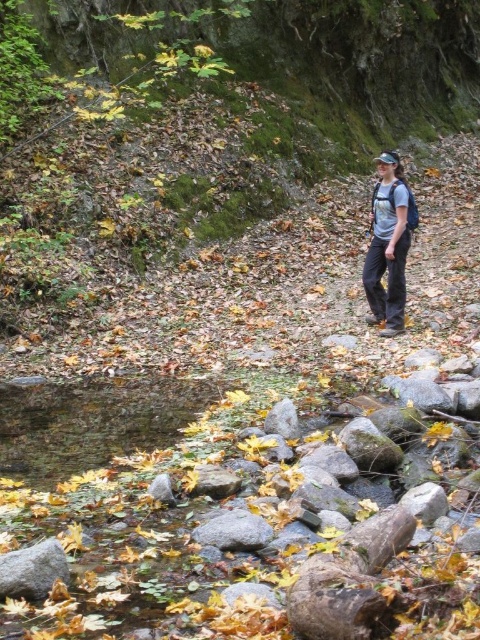
Is green mossy hillside at center shorter than gray rock at lower left?

No.

Is green mossy hillside at center bigger than gray rock at lower left?

Yes.

Where is `green mossy hillside at center`? This screenshot has width=480, height=640. green mossy hillside at center is located at coordinates (219, 177).

You are a GUI agent. You are given a task and a screenshot of the screen. Output one action in this format:
    pyautogui.click(x=<x>, y=<y>)
    Task: Click on the green mossy hillside at center
    The height and width of the screenshot is (640, 480).
    Given the screenshot: What is the action you would take?
    pyautogui.click(x=219, y=177)

At what (x,y) coordinates should I click in order to perform the action: click on green mossy hillside at center. Please return your answer as a coordinate pair (x, y). The image size is (480, 640). Looking at the image, I should click on (219, 177).

Can you confirm if green mossy hillside at center is taller than matte gray shirt at center?

Yes.

Image resolution: width=480 pixels, height=640 pixels. In order to click on green mossy hillside at center in this screenshot , I will do `click(219, 177)`.

Identify the location of green mossy hillside at center. The width and height of the screenshot is (480, 640). (219, 177).

Looking at this image, which of these two, matte gray shirt at center or gray rock at lower left, stands shorter?

Standing shorter between the two is gray rock at lower left.

Who is positioned more to the right, matte gray shirt at center or gray rock at lower left?

Positioned to the right is matte gray shirt at center.

Between point (372, 317) and point (20, 584), which one is positioned in front?

Point (20, 584)

Where is `matte gray shirt at center`? matte gray shirt at center is located at coordinates (388, 244).